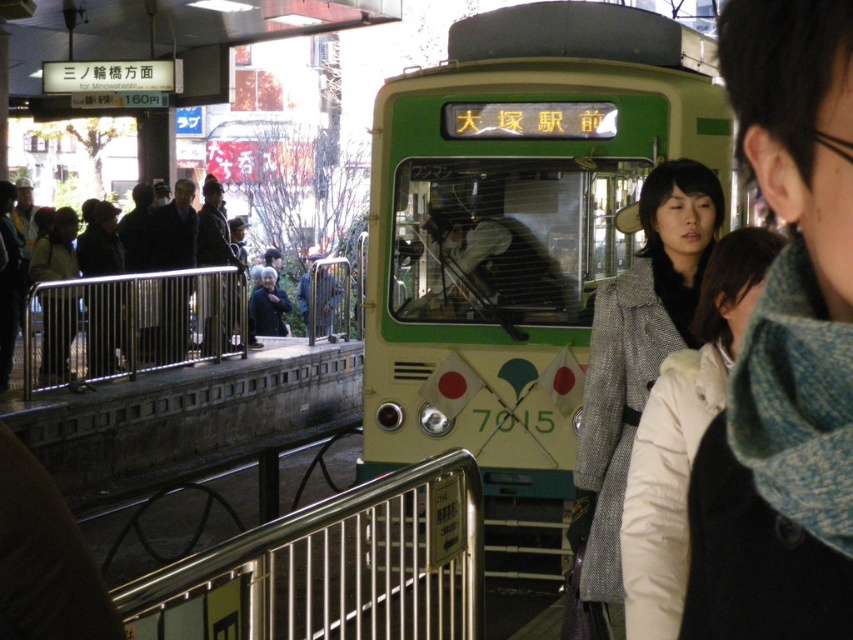
Does satin silver railing at left appear over dark brown coat at center?

No.

Can you confirm if satin silver railing at left is positioned to the right of dark brown coat at center?

Result: Correct, you'll find satin silver railing at left to the right of dark brown coat at center.

Does point (241, 316) lie in front of point (184, 221)?

No, (241, 316) is behind (184, 221).

The image size is (853, 640). Identify the location of satin silver railing at left. (131, 324).

This screenshot has height=640, width=853. Identify the location of green matte bus at center. (x=517, y=236).

Which is more to the right, green matte bus at center or satin silver railing at left?

Positioned to the right is green matte bus at center.

Does point (379, 451) come farther from viewer compared to point (160, 300)?

No.

At what (x,y) coordinates should I click in order to perform the action: click on green matte bus at center. Please return your answer as a coordinate pair (x, y). The height and width of the screenshot is (640, 853). Looking at the image, I should click on (517, 236).

Does dark brown coat at center have a greater height compared to dark gray fabric jacket at center?

Correct, dark brown coat at center is much taller as dark gray fabric jacket at center.

Identify the location of dark brown coat at center. This screenshot has height=640, width=853. (173, 230).

Identify the location of dark brown coat at center. pos(173,230).